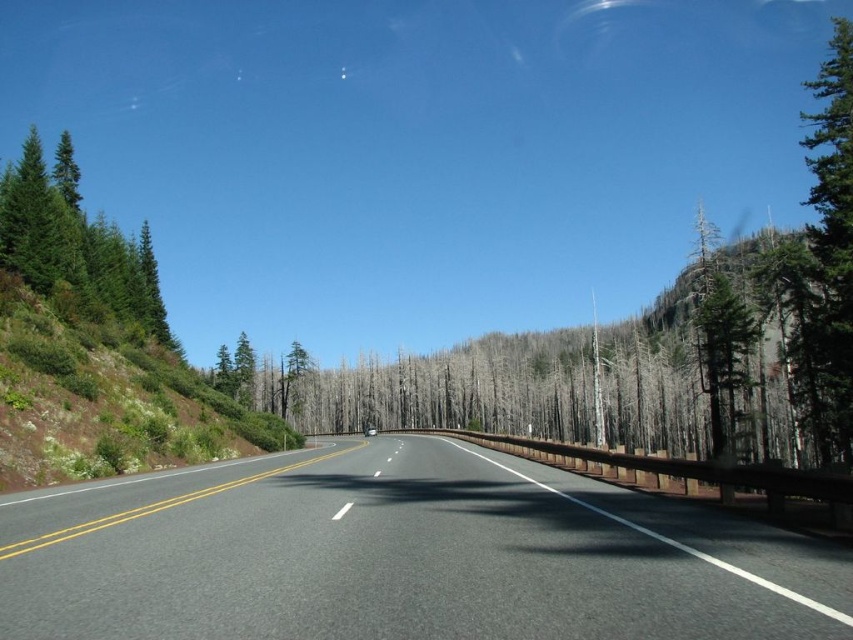
Does black asphalt highway at center have a lesser height compared to green rough bark tree at right?

Indeed, black asphalt highway at center has a lesser height compared to green rough bark tree at right.

At what (x,y) coordinates should I click in order to perform the action: click on black asphalt highway at center. Please return your answer as a coordinate pair (x, y). Looking at the image, I should click on (402, 556).

Locate an element on the screen. black asphalt highway at center is located at coordinates (402, 556).

Between black asphalt highway at center and green matte evergreen trees at left, which one appears on the right side from the viewer's perspective?

Positioned to the right is black asphalt highway at center.

Is point (107, 552) positioned before point (91, 275)?

Yes, it is.

Measure the distance between black asphalt highway at center and camera.

black asphalt highway at center and camera are 5.08 meters apart.

The height and width of the screenshot is (640, 853). What are the coordinates of `black asphalt highway at center` in the screenshot? It's located at (402, 556).

Between green shrubbery at left and green matte tree at right, which one appears on the right side from the viewer's perspective?

green matte tree at right is more to the right.

Can you confirm if green shrubbery at left is taller than green matte tree at right?

No.

The height and width of the screenshot is (640, 853). In order to click on green shrubbery at left in this screenshot , I will do `click(106, 400)`.